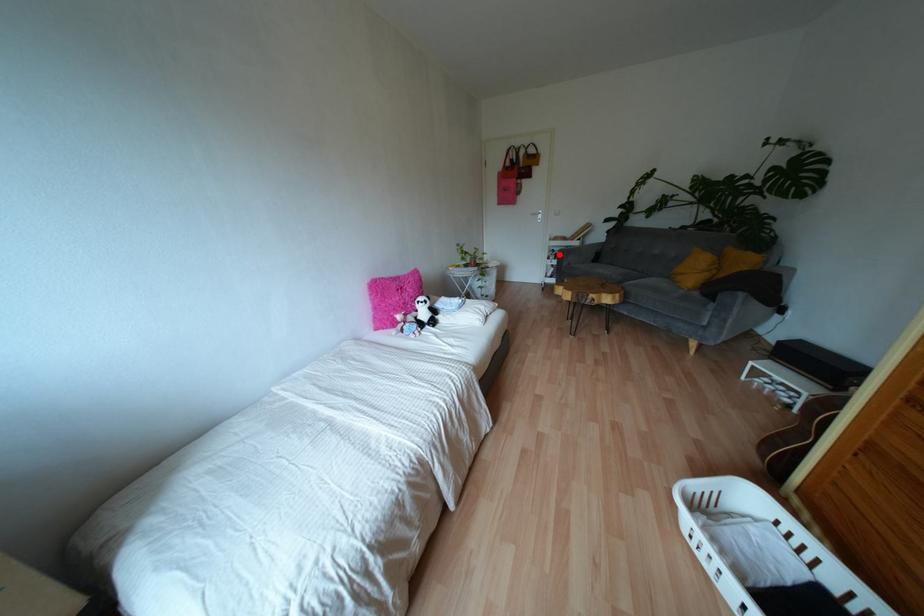
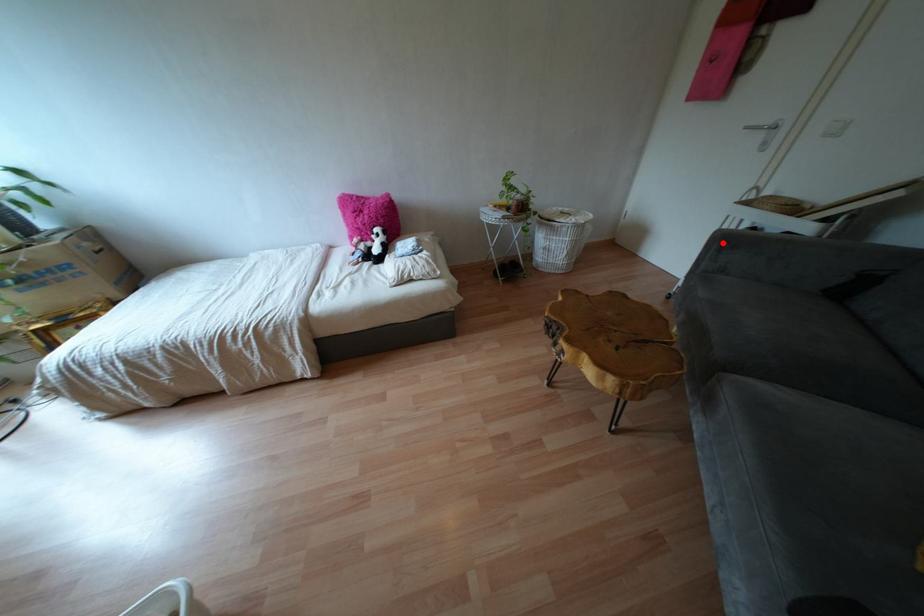
I am providing you with two images of the same scene from different viewpoints. A red point is marked on the first image and another point is marked on the second image. Do the highlighted points in image1 and image2 indicate the same real-world spot?

Yes